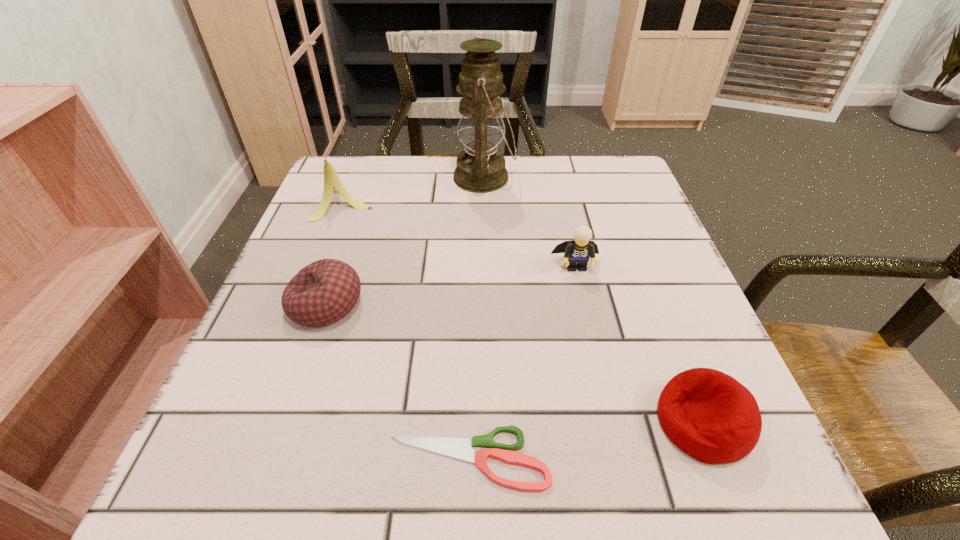
This screenshot has width=960, height=540. Identify the location of vacant area at the right edge. (658, 248).

Where is `blank area at the far left corner`? blank area at the far left corner is located at coordinates (341, 207).

Where is `free space at the far right corner`? The width and height of the screenshot is (960, 540). free space at the far right corner is located at coordinates (607, 207).

Locate an element on the screen. The image size is (960, 540). vacant space at the near right corner of the desktop is located at coordinates (764, 443).

Locate an element on the screen. This screenshot has height=540, width=960. vacant space that's between the scissors and the banana is located at coordinates (407, 330).

What are the coordinates of `free point between the banana and the shortest object` in the screenshot? It's located at (407, 330).

In order to click on vacant area that lies between the fifth shortest object and the tallest object in this screenshot , I will do `click(415, 189)`.

Locate an element on the screen. The height and width of the screenshot is (540, 960). unoccupied area between the banana and the tallest object is located at coordinates (415, 189).

The image size is (960, 540). I want to click on vacant area that lies between the tallest object and the second object from right to left, so click(x=530, y=222).

Locate an element on the screen. empty space that is in between the oil lamp and the right beanbag is located at coordinates (593, 300).